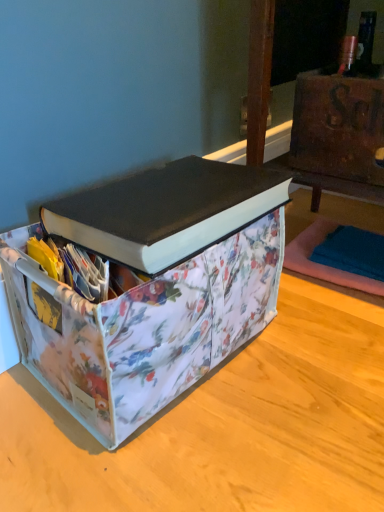
Question: From the image's perspective, is black matte book at upper center beneath floral fabric storage bin at lower right?

Choices:
 (A) no
 (B) yes

Answer: (B)

Question: Is black matte book at upper center oriented towards floral fabric storage bin at lower right?

Choices:
 (A) yes
 (B) no

Answer: (B)

Question: From a real-world perspective, is black matte book at upper center physically below floral fabric storage bin at lower right?

Choices:
 (A) no
 (B) yes

Answer: (B)

Question: Considering the relative sizes of black matte book at upper center and floral fabric storage bin at lower right in the image provided, is black matte book at upper center shorter than floral fabric storage bin at lower right?

Choices:
 (A) yes
 (B) no

Answer: (A)

Question: Considering the relative positions of black matte book at upper center and floral fabric storage bin at lower right in the image provided, is black matte book at upper center behind floral fabric storage bin at lower right?

Choices:
 (A) yes
 (B) no

Answer: (B)

Question: From the image's perspective, is rusty metal chest at upper right positioned above or below black matte book at upper center?

Choices:
 (A) below
 (B) above

Answer: (B)

Question: Do you think rusty metal chest at upper right is within black matte book at upper center, or outside of it?

Choices:
 (A) outside
 (B) inside

Answer: (A)

Question: Considering the positions of point (336, 148) and point (57, 225), is point (336, 148) closer or farther from the camera than point (57, 225)?

Choices:
 (A) closer
 (B) farther

Answer: (B)

Question: Is rusty metal chest at upper right in front of or behind black matte book at upper center in the image?

Choices:
 (A) front
 (B) behind

Answer: (B)

Question: From the image's perspective, is floral fabric storage bin at center located above or below black matte book at upper center?

Choices:
 (A) below
 (B) above

Answer: (A)

Question: Considering the positions of floral fabric storage bin at center and black matte book at upper center in the image, is floral fabric storage bin at center bigger or smaller than black matte book at upper center?

Choices:
 (A) big
 (B) small

Answer: (A)

Question: Do you think floral fabric storage bin at center is within black matte book at upper center, or outside of it?

Choices:
 (A) inside
 (B) outside

Answer: (B)

Question: Would you say floral fabric storage bin at center is to the left or to the right of black matte book at upper center in the picture?

Choices:
 (A) right
 (B) left

Answer: (B)

Question: Is black matte book at upper center wider or thinner than floral fabric storage bin at center?

Choices:
 (A) thin
 (B) wide

Answer: (A)

Question: Is black matte book at upper center situated inside floral fabric storage bin at center or outside?

Choices:
 (A) inside
 (B) outside

Answer: (B)